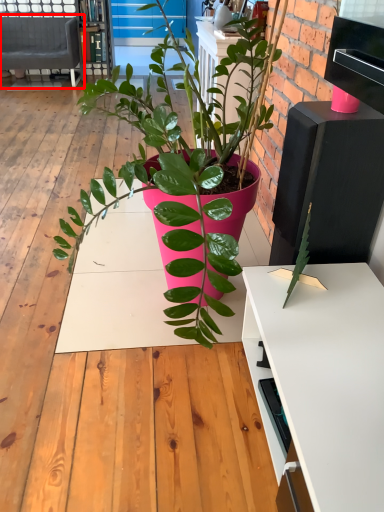
Question: Observing the image, what is the correct spatial positioning of studio couch (annotated by the red box) in reference to bookshelf?

Choices:
 (A) right
 (B) left

Answer: (B)